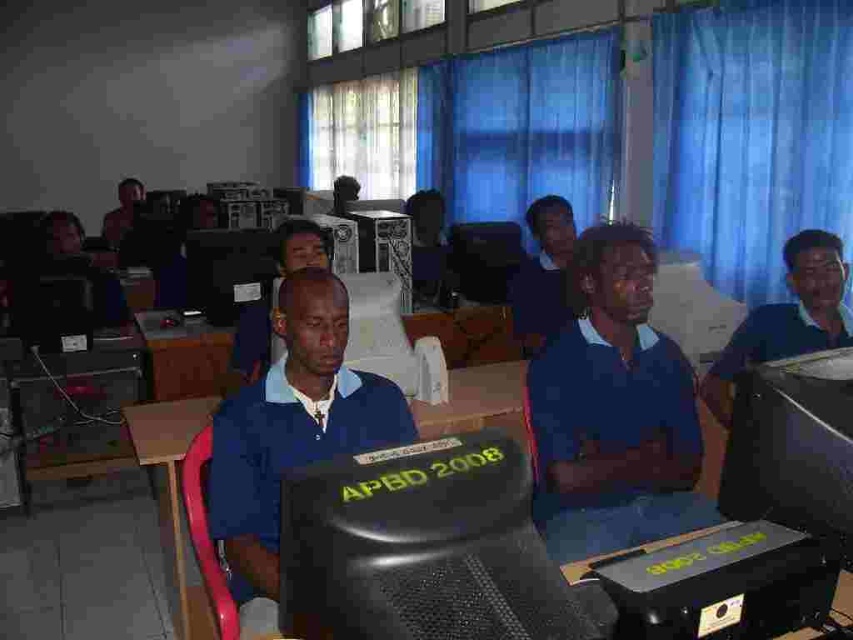
Question: Can you confirm if blue shirt at right is bigger than blue shirt at center?

Choices:
 (A) no
 (B) yes

Answer: (B)

Question: Considering the relative positions of wooden table at center and blue shirt at right in the image provided, where is wooden table at center located with respect to blue shirt at right?

Choices:
 (A) right
 (B) left

Answer: (B)

Question: Which object is farther from the camera taking this photo?

Choices:
 (A) wooden table at center
 (B) black glossy monitor at right
 (C) matte black monitor at center
 (D) blue shirt at center

Answer: (C)

Question: Which of the following is the closest to the observer?

Choices:
 (A) (560, 236)
 (B) (763, 502)
 (C) (512, 397)
 (D) (741, 349)

Answer: (B)

Question: Is the position of wooden table at center less distant than that of matte black laptop at upper left?

Choices:
 (A) no
 (B) yes

Answer: (B)

Question: Based on their relative distances, which object is nearer to the blue fabric shirt at center?

Choices:
 (A) wooden table at center
 (B) blue shirt at right
 (C) matte black laptop at upper left
 (D) blue shirt at center

Answer: (A)